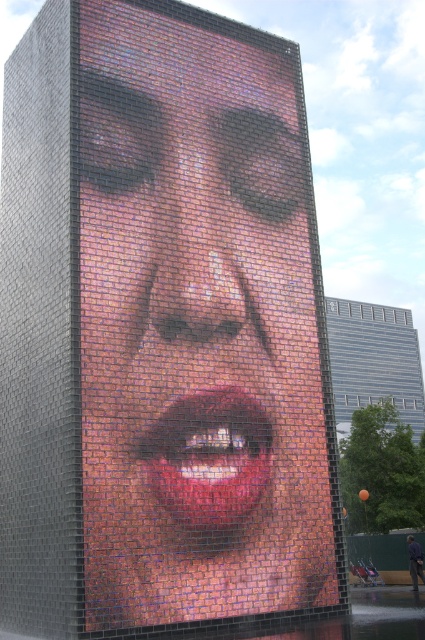
You are standing in front of the modern art installation. You want to take a photo of the shiny metallic face at center with your smartphone. The recommended distance for clear photos is between 5 to 7 meters. Is your current position suitable for taking a clear photo?

The shiny metallic face at center is 8.04 meters away from the camera. Since the recommended distance is between 5 to 7 meters, your current position is too far to take a clear photo. You should move closer to within 7 meters for better results.

You are an architect analyzing the public art installation. You notice a point at coordinates (200, 324) on the facade. What does this point represent?

The point at coordinates (200, 324) indicates the location of the shiny metallic face at center.